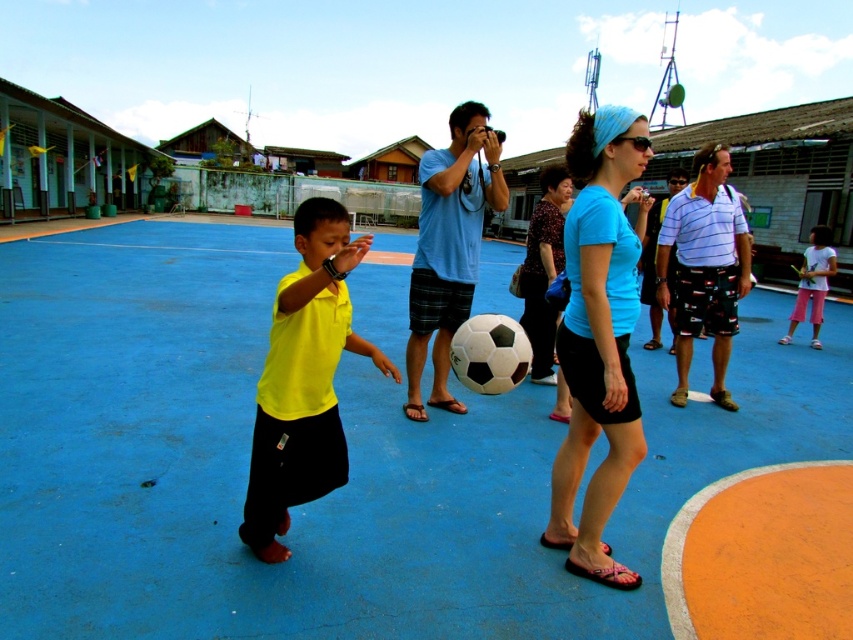
Question: Which object is closer to the camera taking this photo?

Choices:
 (A) blue rubber basketball court at center
 (B) yellow matte shirt at center
 (C) pink cotton shorts at lower right
 (D) light blue t-shirt at center

Answer: (B)

Question: Can you confirm if yellow matte shirt at center is positioned above pink cotton shorts at lower right?

Choices:
 (A) no
 (B) yes

Answer: (A)

Question: Which object is closer to the camera taking this photo?

Choices:
 (A) pink cotton shorts at lower right
 (B) light blue t-shirt at center

Answer: (B)

Question: Is light blue t-shirt at center thinner than pink cotton shorts at lower right?

Choices:
 (A) no
 (B) yes

Answer: (B)

Question: Can you confirm if blue rubber basketball court at center is bigger than yellow matte shirt at center?

Choices:
 (A) yes
 (B) no

Answer: (A)

Question: Estimate the real-world distances between objects in this image. Which object is closer to the yellow matte shirt at center?

Choices:
 (A) pink cotton shorts at lower right
 (B) blue rubber basketball court at center
 (C) light blue t-shirt at center

Answer: (C)